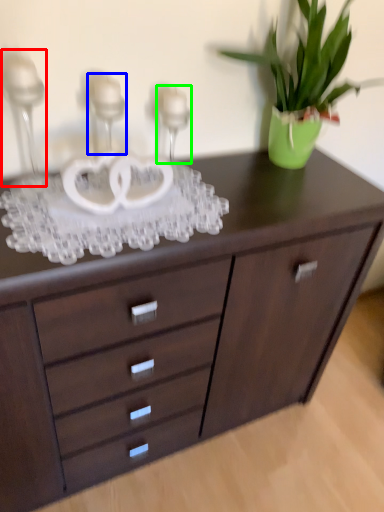
Question: Considering the real-world distances, which object is closest to candle holder (highlighted by a red box)? candle holder (highlighted by a blue box) or candle holder (highlighted by a green box).

Choices:
 (A) candle holder
 (B) candle holder

Answer: (A)